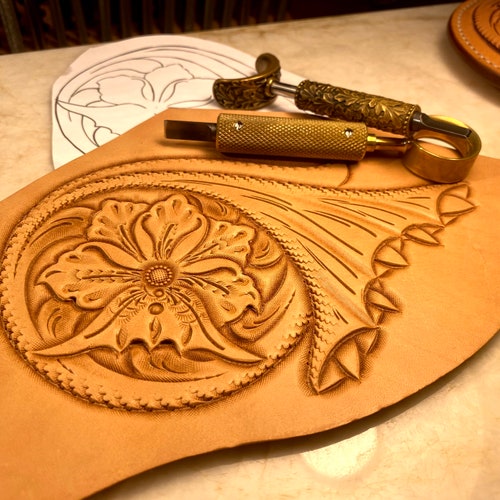
Locate an element on the screen. The height and width of the screenshot is (500, 500). space above table is located at coordinates (126, 17).